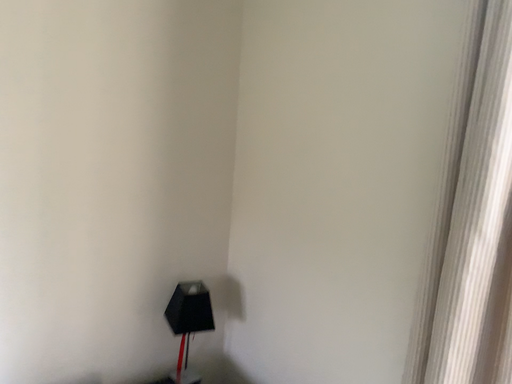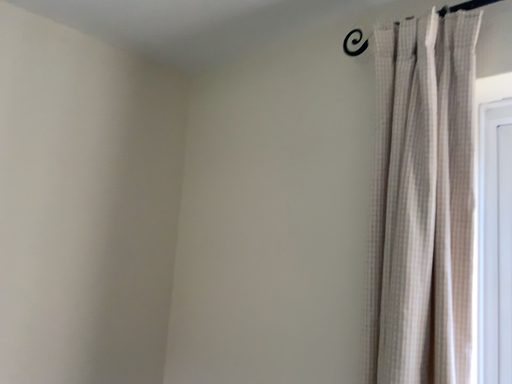
Question: How did the camera likely rotate when shooting the video?

Choices:
 (A) rotated left
 (B) rotated right

Answer: (B)